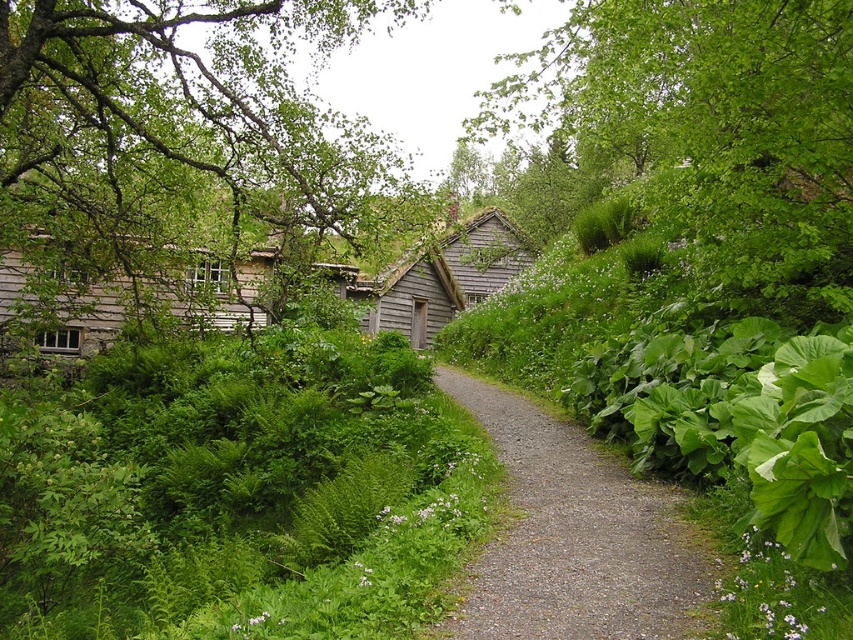
You are standing at the starting point of the gravel path and want to reach the wooden cabins on the left. Which direction should you head towards to avoid the green leafy tree at left?

The green leafy tree at left is located at point (186,132), so you should head towards the right side of the path to avoid it.

You are planning to plant a new tree that requires at least 40 feet of space between it and any existing structures. Based on the scene, can the green leafy tree at upper center be safely planted near the wooden shingles cabin at center?

The green leafy tree at upper center is 42.32 feet away from the wooden shingles cabin at center, which exceeds the required 40 feet of space. Therefore, it can be safely planted near the cabin.